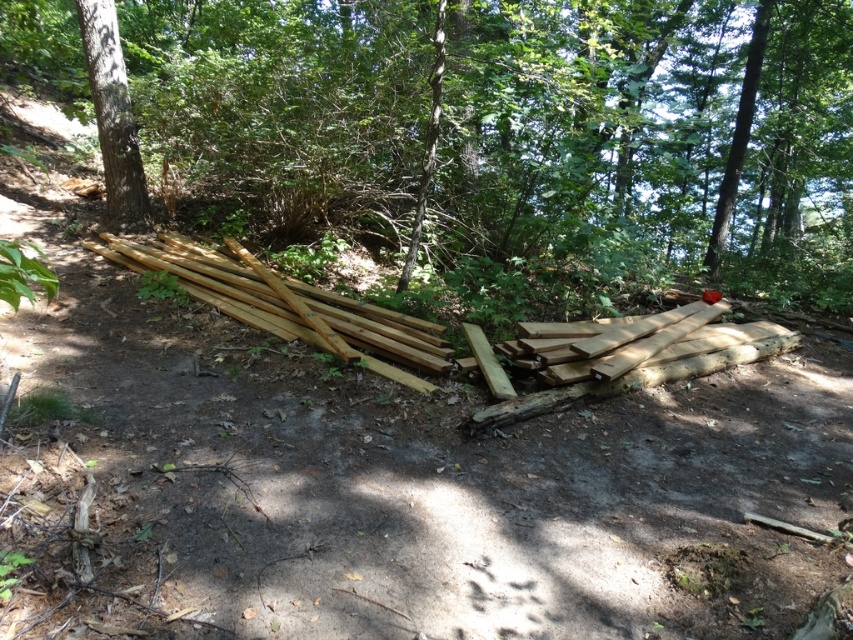
Question: Is natural wood at left below natural wood at center?

Choices:
 (A) no
 (B) yes

Answer: (A)

Question: Which point is closer to the camera?

Choices:
 (A) natural wood at center
 (B) natural wood at left

Answer: (A)

Question: Among these objects, which one is farthest from the camera?

Choices:
 (A) natural wood at left
 (B) smooth brown tree trunk at upper left

Answer: (B)

Question: Is smooth brown wood at center above natural wood at center?

Choices:
 (A) no
 (B) yes

Answer: (B)

Question: Which object is the farthest from the smooth brown wood at center?

Choices:
 (A) natural wood at left
 (B) smooth brown tree trunk at upper left

Answer: (B)

Question: Is natural wood at left closer to the viewer compared to natural wood at center?

Choices:
 (A) yes
 (B) no

Answer: (B)